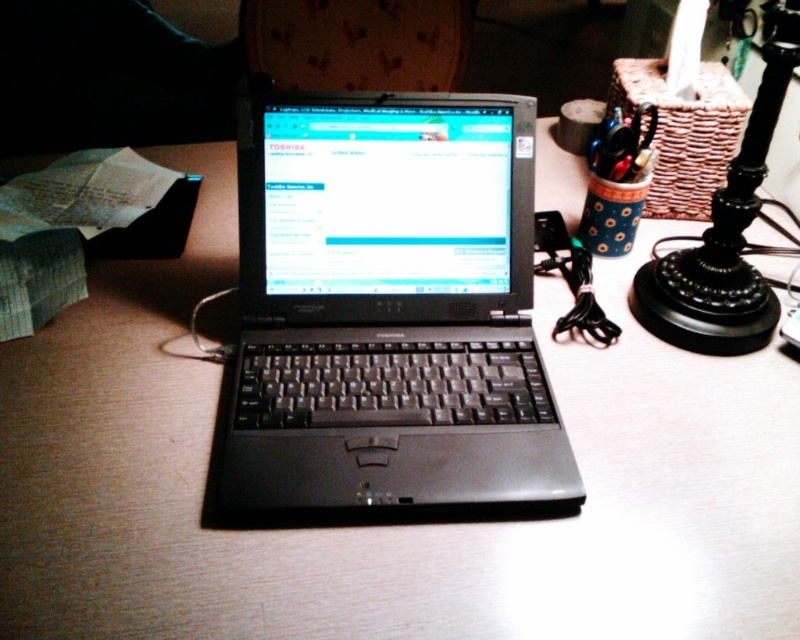
Can you confirm if black plastic laptop at center is thinner than black metal lamp at upper right?

No, black plastic laptop at center is not thinner than black metal lamp at upper right.

Is black plastic laptop at center bigger than black metal lamp at upper right?

No.

This screenshot has width=800, height=640. I want to click on black plastic laptop at center, so click(388, 308).